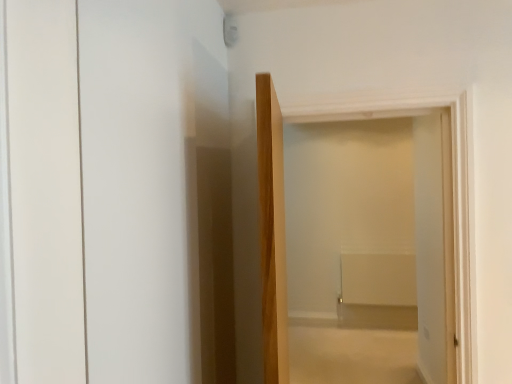
Question: Is white matte door at center wider or thinner than white glossy door at left?

Choices:
 (A) wide
 (B) thin

Answer: (A)

Question: Is point (266, 380) positioned closer to the camera than point (39, 201)?

Choices:
 (A) closer
 (B) farther

Answer: (B)

Question: Do you think white matte door at center is within white glossy door at left, or outside of it?

Choices:
 (A) outside
 (B) inside

Answer: (A)

Question: From a real-world perspective, is white glossy door at left physically located above or below white matte door at center?

Choices:
 (A) below
 (B) above

Answer: (B)

Question: Do you think white glossy door at left is within white matte door at center, or outside of it?

Choices:
 (A) outside
 (B) inside

Answer: (A)

Question: Is white glossy door at left taller or shorter than white matte door at center?

Choices:
 (A) short
 (B) tall

Answer: (A)

Question: Is point (151, 334) closer or farther from the camera than point (285, 347)?

Choices:
 (A) closer
 (B) farther

Answer: (A)